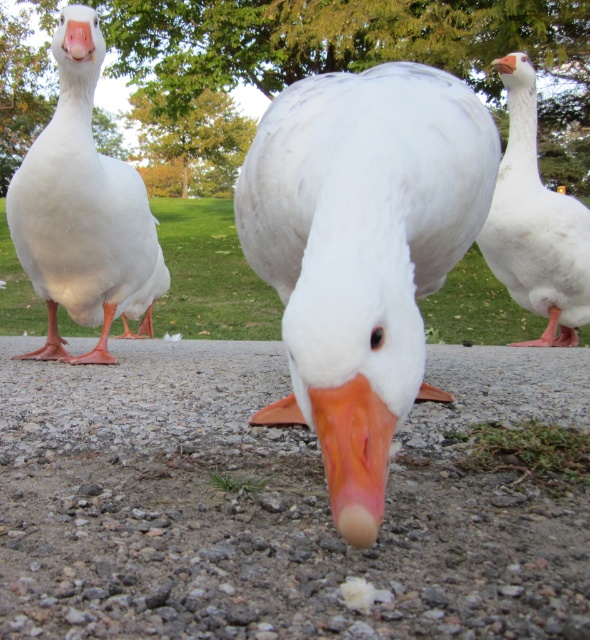
Based on the photo, you are standing in the park and want to throw a treat to the geese. The first treat lands at point A, which is at coordinate point (139, 401), and the second treat lands at point B, which is at coordinate point (565, 208). Which treat is closer to you?

The treat at point A, which is at coordinate point (139, 401), is closer to you because point A is closer to the camera than point B.

You are a photographer trying to capture a clear photo of the white matte duck at center and the matte white duck at left. However, you notice that one of them is blocking the view of the other. Which duck is blocking the view of the other?

The white matte duck at center is positioned under the matte white duck at left, meaning the matte white duck at left is blocking the view of the white matte duck at center.

You are a photographer trying to capture a photo of the white matte duck at center and the matte white duck at left. If you want to make sure both ducks are in focus, which duck should you focus on first to ensure the depth of field captures both?

Since the white matte duck at center is smaller compared to the matte white duck at left, you should focus on the matte white duck at left first because it is larger and likely closer to the camera, ensuring the depth of field will include both.